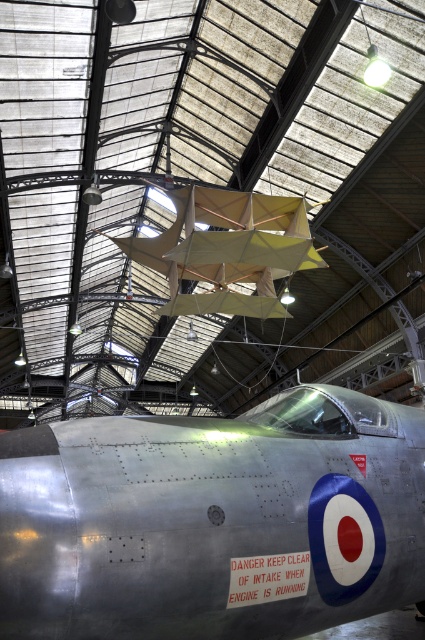
From the picture: Is silver metallic airplane at center below matte yellow paper airplane at center?

Yes, silver metallic airplane at center is below matte yellow paper airplane at center.

Who is higher up, silver metallic airplane at center or matte yellow paper airplane at center?

matte yellow paper airplane at center

Is point (285, 497) closer to viewer compared to point (223, 268)?

That is True.

You are a GUI agent. You are given a task and a screenshot of the screen. Output one action in this format:
    pyautogui.click(x=<x>, y=<y>)
    Task: Click on the silver metallic airplane at center
    This screenshot has height=640, width=425.
    Given the screenshot: What is the action you would take?
    pyautogui.click(x=212, y=520)